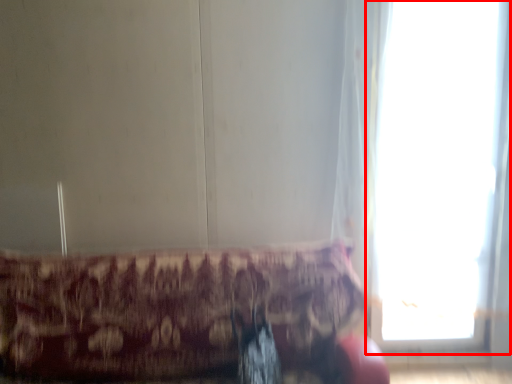
Question: From the image, what is the correct spatial relationship of window (annotated by the red box) in relation to furniture?

Choices:
 (A) right
 (B) left

Answer: (A)